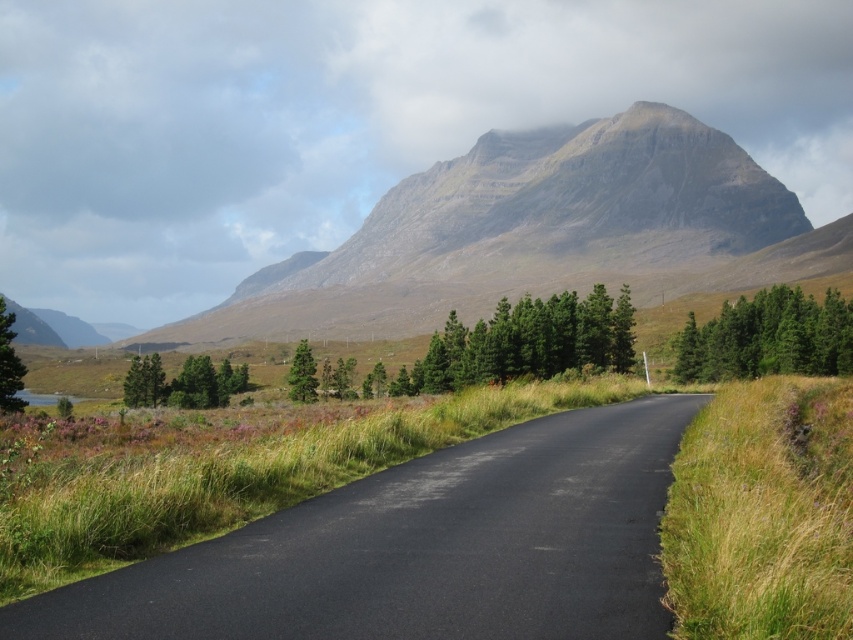
You are standing at the start of the winding road in the image. You see the green matte trees at center and the green matte tree at right. Which one is closer to you?

The green matte trees at center is 24.99 meters away from the green matte tree at right, so the green matte tree at right is closer to you.

You are standing at the point closest to the camera in the image. Looking along the winding road, you see two points marked on the road surface. The first point is at coordinate point(132, 394) and the second point is at point(10, 333). Which of these two points is farther away from you along the road?

Point(132, 394) is behind point(10, 333), so the point farther away from you is point(132, 394).

You are a hiker standing on the winding road and want to determine which tree is shorter between the green textured trees at left and the green matte tree at left. Which one is shorter?

The green textured trees at left is shorter than the green matte tree at left according to the description.